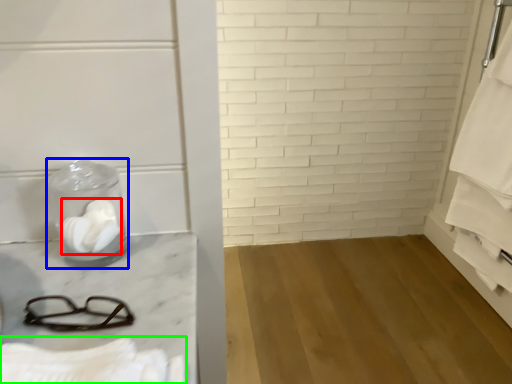
Question: Which object is positioned closest to toilet paper (highlighted by a red box)? Select from glass jar (highlighted by a blue box) and bath towel (highlighted by a green box).

Choices:
 (A) glass jar
 (B) bath towel

Answer: (A)